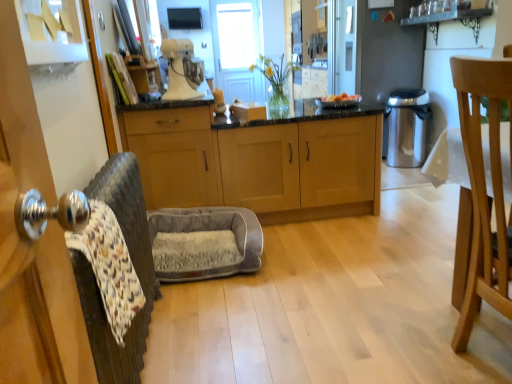
Question: Would you say stainless steel trash can at right is to the left or to the right of light brown wood cabinets at center, positioned as the 2th cabinetry in left-to-right order, in the picture?

Choices:
 (A) right
 (B) left

Answer: (A)

Question: Based on their sizes in the image, would you say stainless steel trash can at right is bigger or smaller than light brown wood cabinets at center, positioned as the 2th cabinetry in left-to-right order?

Choices:
 (A) small
 (B) big

Answer: (A)

Question: Based on their relative distances, which object is nearer to the light brown wooden chair at right?

Choices:
 (A) white matte stand mixer at upper center
 (B) patterned fabric swivel chair at left, which is the 1th swivel chair in front-to-back order
 (C) stainless steel trash can at right
 (D) light brown wood cabinets at center, acting as the first cabinetry starting from the right
 (E) gray plush pet bed at center, which ranks as the second swivel chair in front-to-back order

Answer: (B)

Question: Considering the real-world distances, which object is closest to the matte wood cabinets at center, marked as the second cabinetry in a right-to-left arrangement?

Choices:
 (A) white matte stand mixer at upper center
 (B) light brown wooden chair at right
 (C) light brown wood cabinets at center, positioned as the 2th cabinetry in left-to-right order
 (D) gray plush pet bed at center, which ranks as the second swivel chair in front-to-back order
 (E) stainless steel trash can at right

Answer: (A)